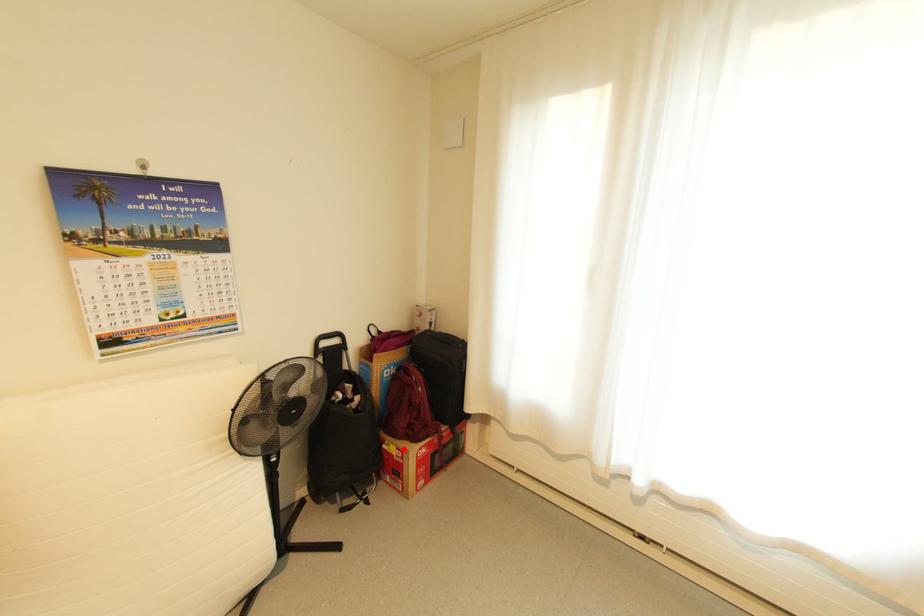
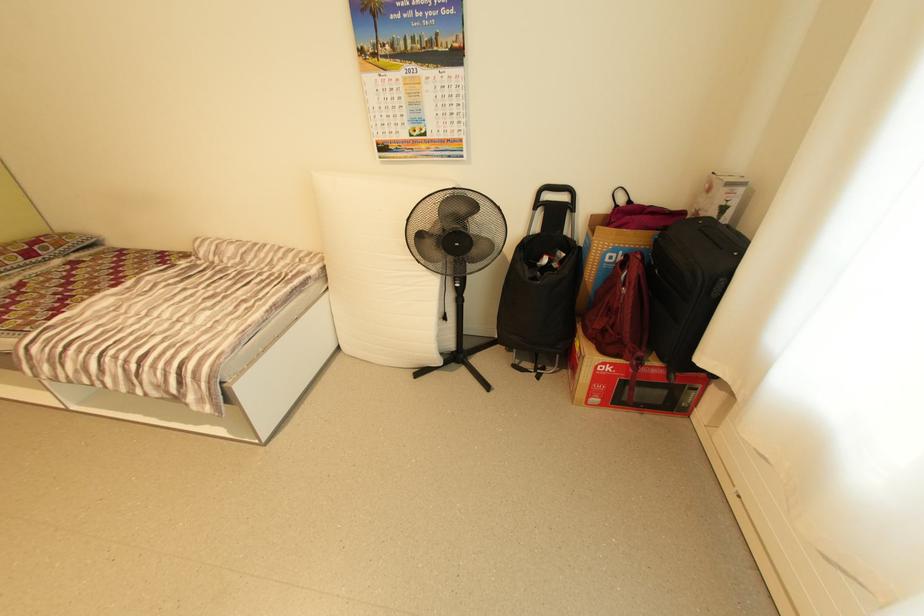
Question: I am providing you with two images of the same scene from different viewpoints. Image1 has a red point marked. In image2, the corresponding 3D location appears at what relative position? Reply with the corresponding letter.

Choices:
 (A) Closer
 (B) Farther

Answer: (A)